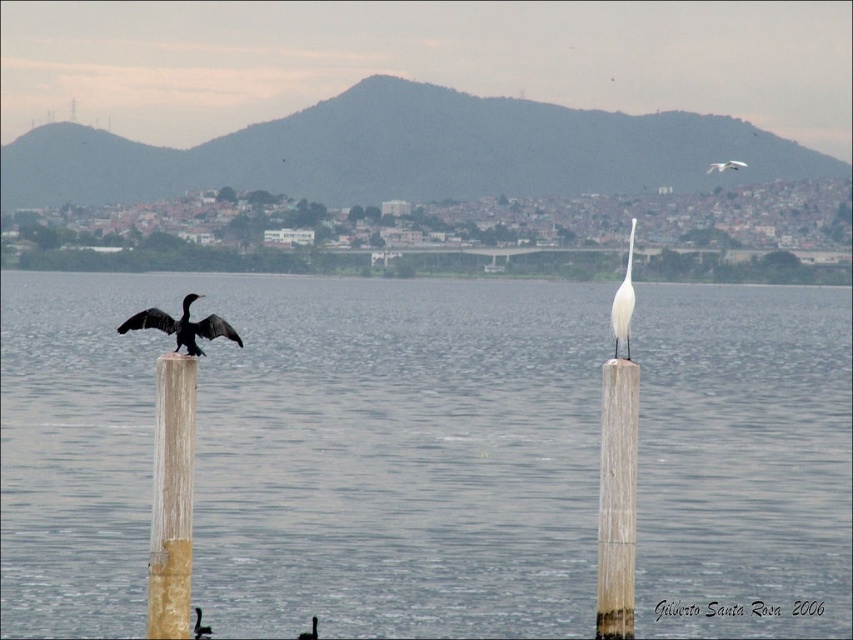
You are standing at the edge of the lake and want to determine which of the two points, point [622,339] or point [735,163], is closer to you. Based on the scene, which point is nearer?

Point [622,339] is closer to the viewer than point [735,163].

Consider the image. You are standing at the point marked as point [625,298]. The lake is 20 meters away from you. Can you see the entire lake surface from your current position?

The distance between you and the lake is 20 meters, which is slightly less than the 20.28 meters mentioned. Since the lake surface is mostly tranquil and there are no obstructions mentioned, you can see most of the lake surface, but not the entire due to the slight distance difference.